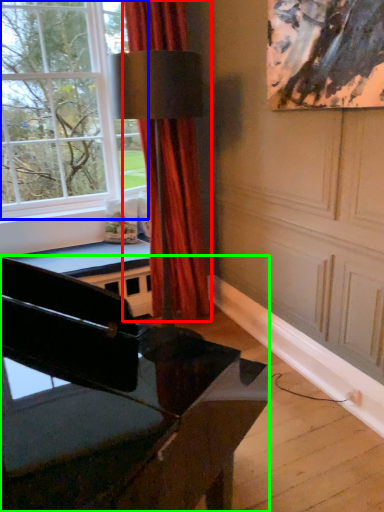
Question: Which object is positioned closest to curtain (highlighted by a red box)? Select from window (highlighted by a blue box) and piano (highlighted by a green box).

Choices:
 (A) window
 (B) piano

Answer: (A)